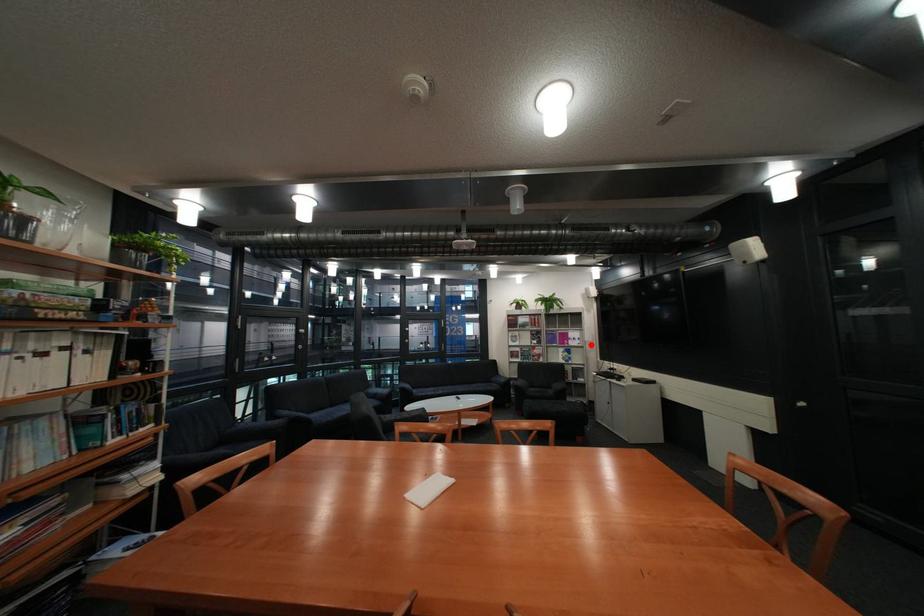
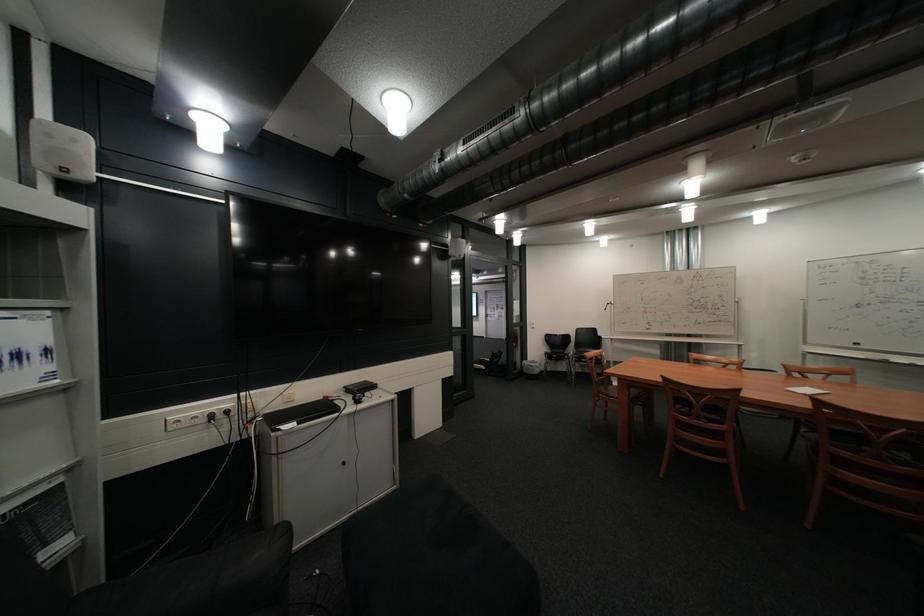
Question: I am providing you with two images of the same scene from different viewpoints. Given a red point in image1, look at the same physical point in image2. Is it:

Choices:
 (A) Closer to the viewpoint
 (B) Farther from the viewpoint

Answer: (A)